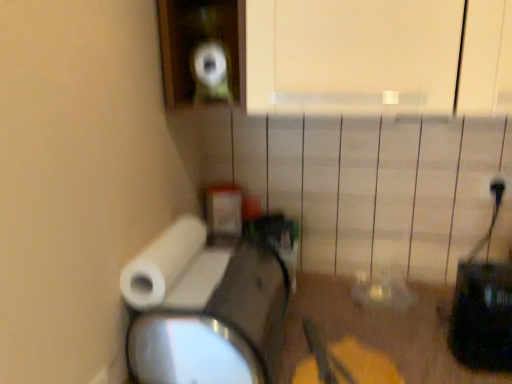
Locate an element on the screen. The image size is (512, 384). white plastic electric outlet at upper right is located at coordinates [495, 187].

Describe the element at coordinates (495, 187) in the screenshot. I see `white plastic electric outlet at upper right` at that location.

I want to click on white matte toilet paper at lower left, so click(162, 263).

The image size is (512, 384). What do you see at coordinates (162, 263) in the screenshot?
I see `white matte toilet paper at lower left` at bounding box center [162, 263].

Identify the location of white plastic electric outlet at upper right. The width and height of the screenshot is (512, 384). (495, 187).

From the picture: Considering the relative positions of white plastic electric outlet at upper right and white matte toilet paper at lower left in the image provided, is white plastic electric outlet at upper right to the left of white matte toilet paper at lower left from the viewer's perspective?

No, white plastic electric outlet at upper right is not to the left of white matte toilet paper at lower left.

Is white plastic electric outlet at upper right positioned before white matte toilet paper at lower left?

No, the depth of white plastic electric outlet at upper right is greater than that of white matte toilet paper at lower left.

Considering the points (506, 196) and (173, 264), which point is in front, point (506, 196) or point (173, 264)?

The point (173, 264) is closer.

From the image's perspective, does white plastic electric outlet at upper right appear higher than white matte toilet paper at lower left?

Correct, white plastic electric outlet at upper right appears higher than white matte toilet paper at lower left in the image.

Looking at this image, from a real-world perspective, which object stands above the other?

In real-world perspective, white plastic electric outlet at upper right is above.

Considering the relative sizes of white plastic electric outlet at upper right and white matte toilet paper at lower left in the image provided, is white plastic electric outlet at upper right wider than white matte toilet paper at lower left?

No.

Considering the sizes of objects white plastic electric outlet at upper right and white matte toilet paper at lower left in the image provided, who is taller, white plastic electric outlet at upper right or white matte toilet paper at lower left?

Standing taller between the two is white matte toilet paper at lower left.

Considering the sizes of white plastic electric outlet at upper right and white matte toilet paper at lower left in the image, is white plastic electric outlet at upper right bigger or smaller than white matte toilet paper at lower left?

In the image, white plastic electric outlet at upper right appears to be smaller than white matte toilet paper at lower left.

Is white matte toilet paper at lower left surrounded by white plastic electric outlet at upper right?

That's incorrect, white matte toilet paper at lower left is not inside white plastic electric outlet at upper right.

Is white plastic electric outlet at upper right placed right next to white matte toilet paper at lower left?

white plastic electric outlet at upper right and white matte toilet paper at lower left are not in contact.

Is white plastic electric outlet at upper right aimed at white matte toilet paper at lower left?

No, white plastic electric outlet at upper right is not turned towards white matte toilet paper at lower left.

How far apart are white plastic electric outlet at upper right and white matte toilet paper at lower left?

81.78 centimeters.

The height and width of the screenshot is (384, 512). There is a white matte toilet paper at lower left. Identify the location of electric outlet above it (from a real-world perspective). (495, 187).

Which object is positioned more to the right, white matte toilet paper at lower left or white plastic electric outlet at upper right?

white plastic electric outlet at upper right.

Does white matte toilet paper at lower left lie in front of white plastic electric outlet at upper right?

Yes, white matte toilet paper at lower left is closer to the camera.

Considering the points (137, 259) and (485, 197), which point is in front, point (137, 259) or point (485, 197)?

Point (137, 259)

From the image's perspective, between white matte toilet paper at lower left and white plastic electric outlet at upper right, which one is located above?

white plastic electric outlet at upper right appears higher in the image.

Consider the image. From a real-world perspective, is white matte toilet paper at lower left above or below white plastic electric outlet at upper right?

In terms of real-world spatial position, white matte toilet paper at lower left is below white plastic electric outlet at upper right.

Which of these two, white matte toilet paper at lower left or white plastic electric outlet at upper right, is wider?

white matte toilet paper at lower left is wider.

Between white matte toilet paper at lower left and white plastic electric outlet at upper right, which one has less height?

white plastic electric outlet at upper right is shorter.

Based on their sizes in the image, would you say white matte toilet paper at lower left is bigger or smaller than white plastic electric outlet at upper right?

In the image, white matte toilet paper at lower left appears to be larger than white plastic electric outlet at upper right.

Do you think white matte toilet paper at lower left is within white plastic electric outlet at upper right, or outside of it?

white matte toilet paper at lower left is outside white plastic electric outlet at upper right.

Would you say white matte toilet paper at lower left is a long distance from white plastic electric outlet at upper right?

No.

Consider the image. Is white matte toilet paper at lower left positioned with its back to white plastic electric outlet at upper right?

white matte toilet paper at lower left is not turned away from white plastic electric outlet at upper right.

How much distance is there between white matte toilet paper at lower left and white plastic electric outlet at upper right?

white matte toilet paper at lower left and white plastic electric outlet at upper right are 32.20 inches apart.

In order to click on toilet paper below the white plastic electric outlet at upper right (from the image's perspective) in this screenshot , I will do `click(162, 263)`.

The height and width of the screenshot is (384, 512). In order to click on electric outlet located above the white matte toilet paper at lower left (from the image's perspective) in this screenshot , I will do `click(495, 187)`.

Find the location of `electric outlet on the right of white matte toilet paper at lower left`. electric outlet on the right of white matte toilet paper at lower left is located at coordinates (495, 187).